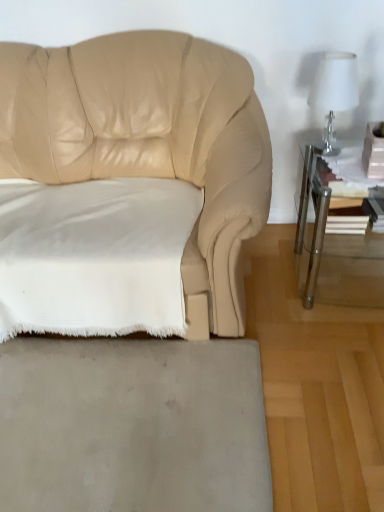
Question: Is white soft fabric pillow at lower left wider or thinner than gray matte rug at lower center?

Choices:
 (A) wide
 (B) thin

Answer: (B)

Question: Considering the positions of white soft fabric pillow at lower left and gray matte rug at lower center in the image, is white soft fabric pillow at lower left bigger or smaller than gray matte rug at lower center?

Choices:
 (A) big
 (B) small

Answer: (A)

Question: Based on their relative distances, which object is nearer to the clear glass table at right?

Choices:
 (A) clear glass table lamp at upper right
 (B) white soft fabric pillow at lower left
 (C) gray matte rug at lower center

Answer: (A)

Question: Which object is positioned closest to the gray matte rug at lower center?

Choices:
 (A) white soft fabric pillow at lower left
 (B) clear glass table at right
 (C) clear glass table lamp at upper right

Answer: (A)